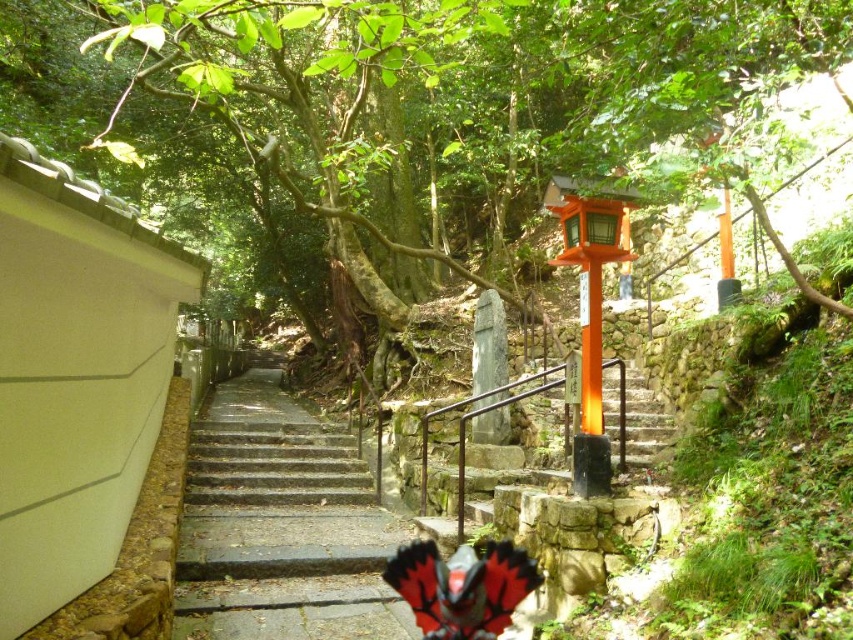
You are a hiker walking up the stone steps at center towards the shrine. As you climb, you notice a green leafy tree at center above you. In which direction does the tree appear relative to your position on the steps?

The green leafy tree at center is above the stone steps at center, so as you climb the steps, the tree appears directly above you.